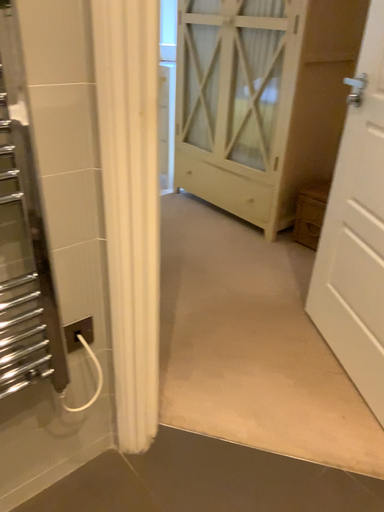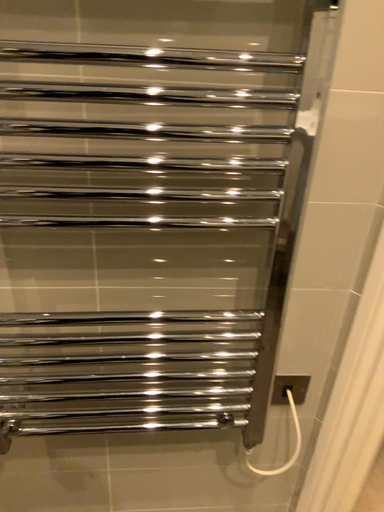
Question: How did the camera likely rotate when shooting the video?

Choices:
 (A) rotated upward
 (B) rotated downward

Answer: (A)